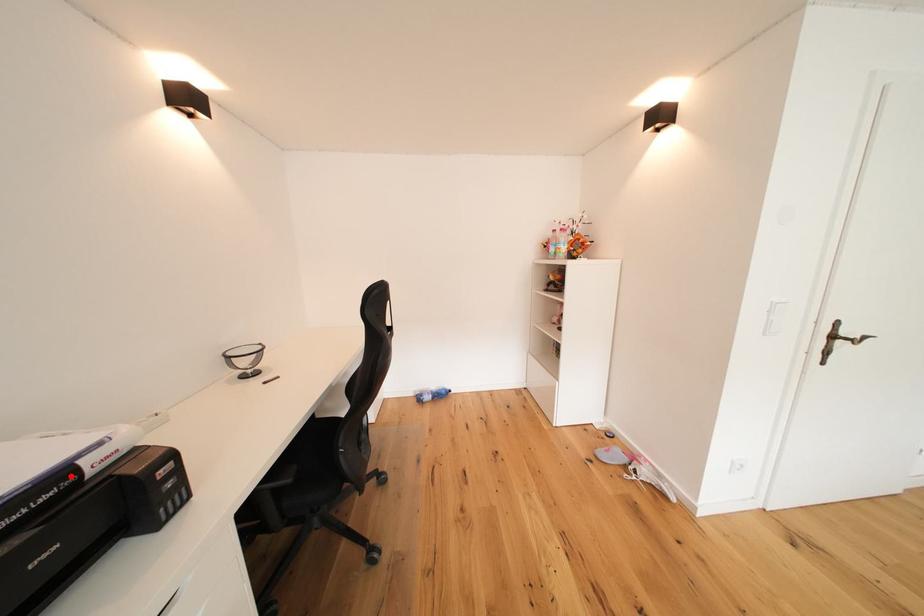
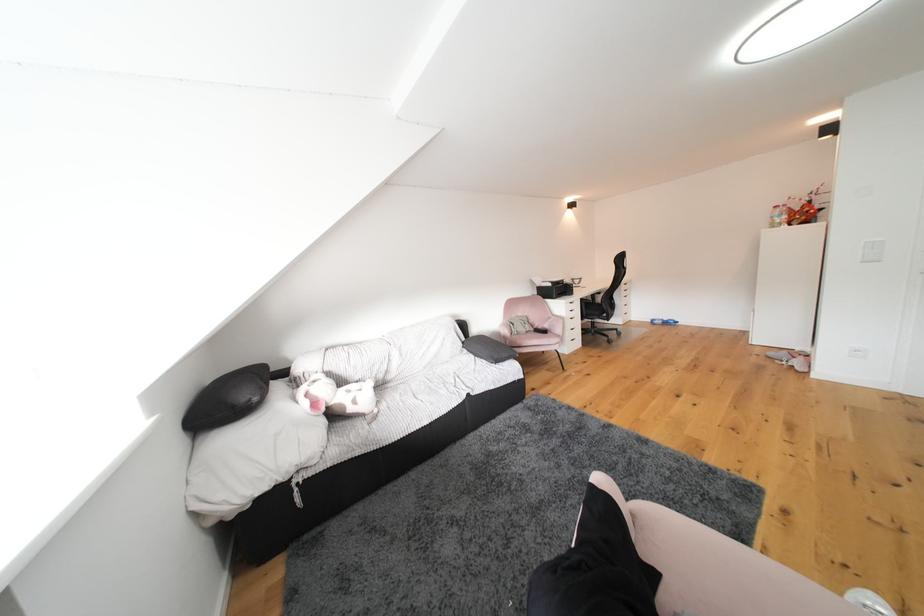
In the second image, find the point that corresponds to the highlighted location in the first image.

(572, 285)